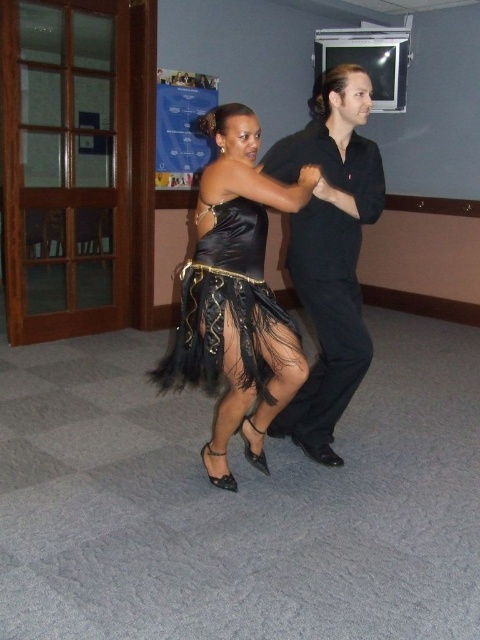
Does satin black dress at center have a greater height compared to black satin shirt at center?

In fact, satin black dress at center may be shorter than black satin shirt at center.

Is point (225, 115) farther from viewer compared to point (313, 275)?

No, it is not.

You are a GUI agent. You are given a task and a screenshot of the screen. Output one action in this format:
    pyautogui.click(x=<x>, y=<y>)
    Task: Click on the satin black dress at center
    The width and height of the screenshot is (480, 640).
    Given the screenshot: What is the action you would take?
    pyautogui.click(x=236, y=296)

In the scene shown: Does satin black dress at center lie behind satin dress at center?

No, it is in front of satin dress at center.

Which is below, satin black dress at center or satin dress at center?

Positioned lower is satin dress at center.

Who is more distant from viewer, (247, 452) or (190, 280)?

The point (247, 452) is more distant.

Locate an element on the screen. This screenshot has height=640, width=480. satin black dress at center is located at coordinates (236, 296).

Is the position of black satin shirt at center less distant than that of satin dress at center?

No.

Which is more to the right, black satin shirt at center or satin dress at center?

black satin shirt at center is more to the right.

Find the location of a particular element. black satin shirt at center is located at coordinates (330, 253).